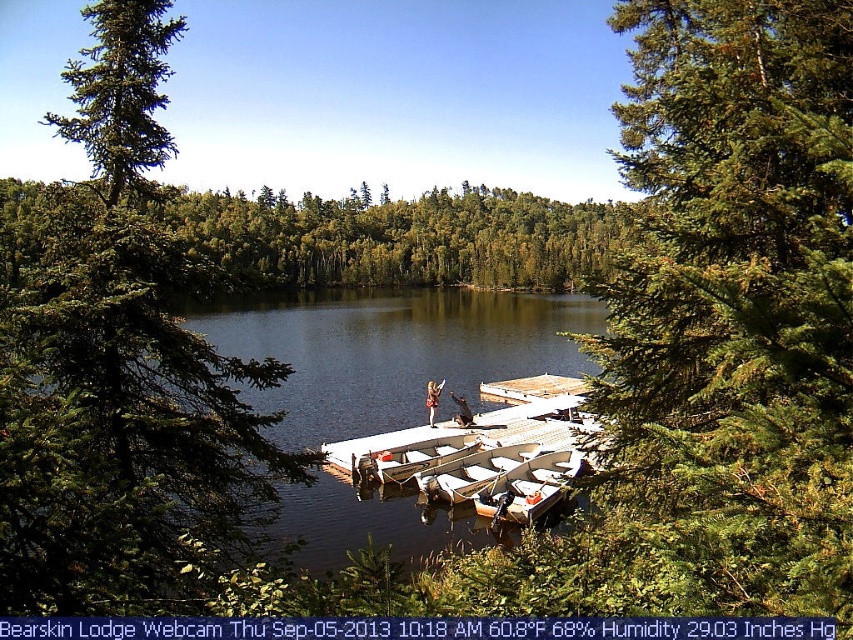
Based on the photo, you are standing on the wooden dock at center and want to reach the light brown leather jacket at center. Which direction should you move to get closer to the jacket?

Since the wooden dock at center is further to the viewer than the light brown leather jacket at center, you should move forward away from the dock towards the jacket to get closer.